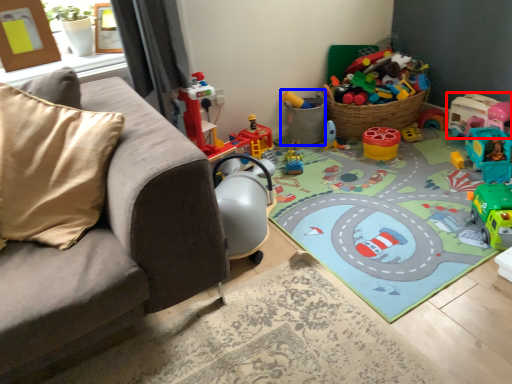
Question: Which object appears closest to the camera in this image, toy (highlighted by a red box) or toy (highlighted by a blue box)?

Choices:
 (A) toy
 (B) toy

Answer: (A)